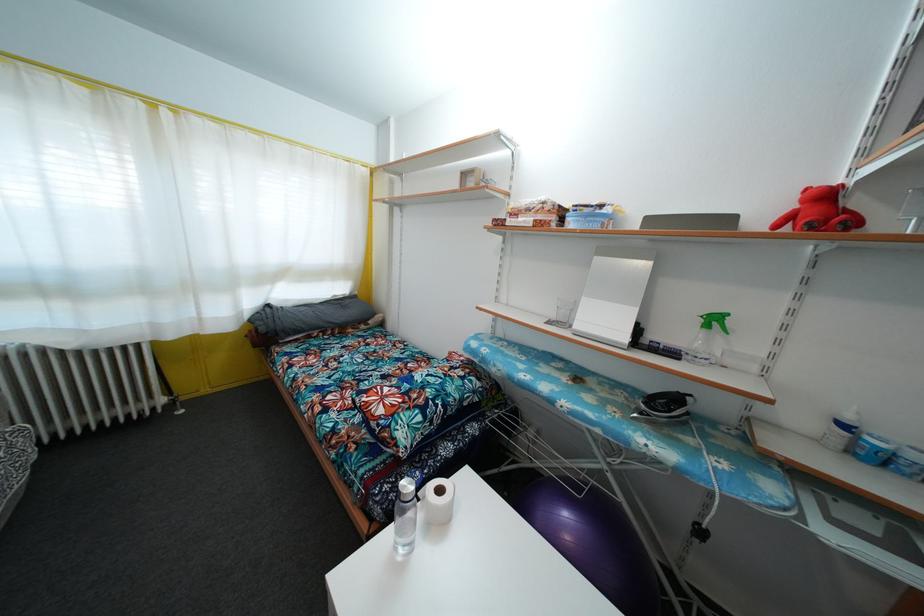
What do you see at coordinates (438, 501) in the screenshot?
I see `the toilet paper roll` at bounding box center [438, 501].